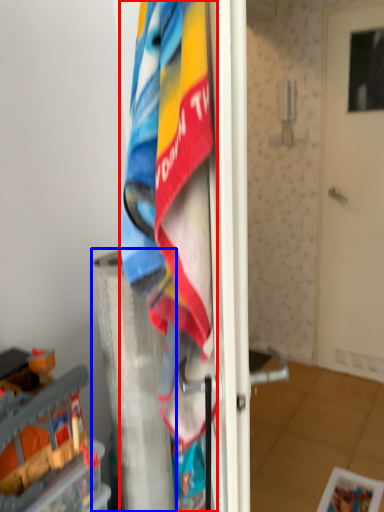
Question: Among these objects, which one is farthest to the camera, towel (highlighted by a red box) or pillar (highlighted by a blue box)?

Choices:
 (A) towel
 (B) pillar

Answer: (B)